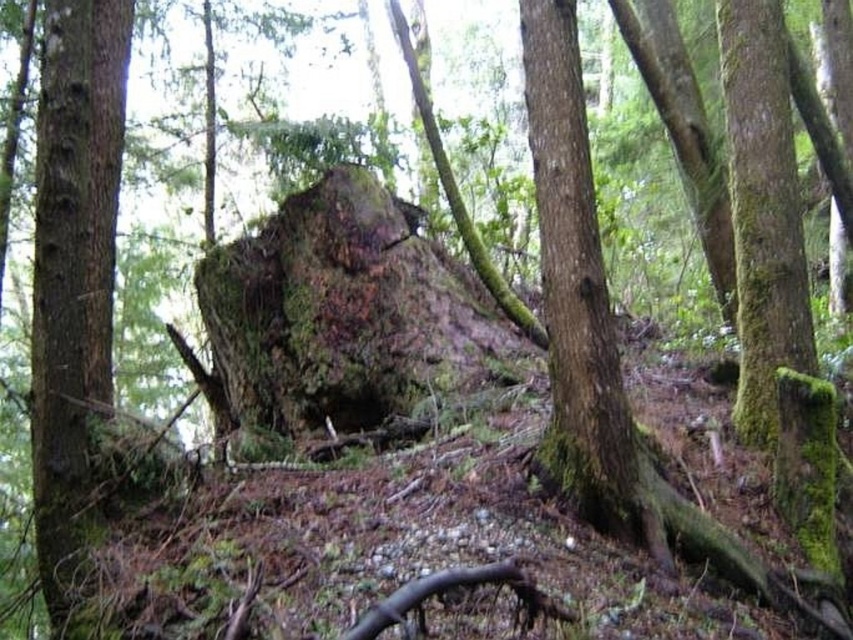
You are a hiker trying to cross a narrow forest path. You see a green mossy rock at center and a green mossy tree trunk at right. Which object is wider, and can you step on the wider one without slipping?

The green mossy rock at center is wider than the green mossy tree trunk at right. Since it is wider, you can step on the green mossy rock at center without slipping as it provides a larger surface area for stability.

Consider the image. You are a hiker navigating through the forest and need to step over the green mossy rock at center and the green mossy tree trunk at center. Which one should you step over first if you are moving from the left to the right direction?

You should step over the green mossy tree trunk at center first because the green mossy rock at center is positioned on its right side, so the tree trunk is on the left side of the rock.

You are a hiker carrying a 3.5 meter long ladder. You want to place the ladder against the green mossy tree trunk at center. Can you fit the ladder without it touching the ground?

The green mossy tree trunk at center is 3.74 meters from camera. Since the ladder is 3.5 meters long, it can be placed against the trunk without touching the ground as the distance is sufficient.